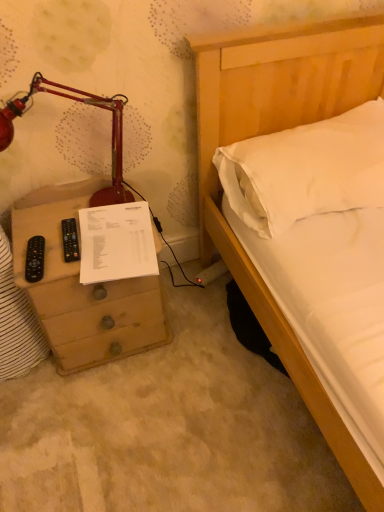
At what (x,y) coordinates should I click in order to perform the action: click on free spot to the right of black plastic remote at left. Please return your answer as a coordinate pair (x, y). Looking at the image, I should click on (87, 254).